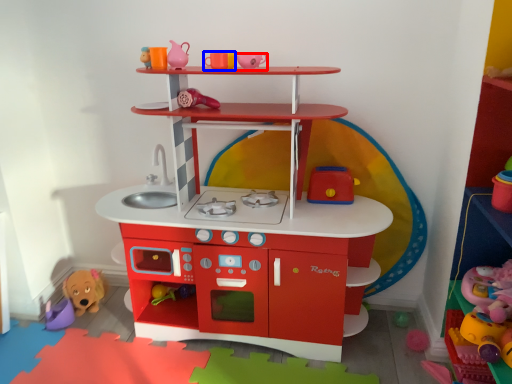
Question: Which object is further to the camera taking this photo, toy (highlighted by a red box) or toy (highlighted by a blue box)?

Choices:
 (A) toy
 (B) toy

Answer: (B)